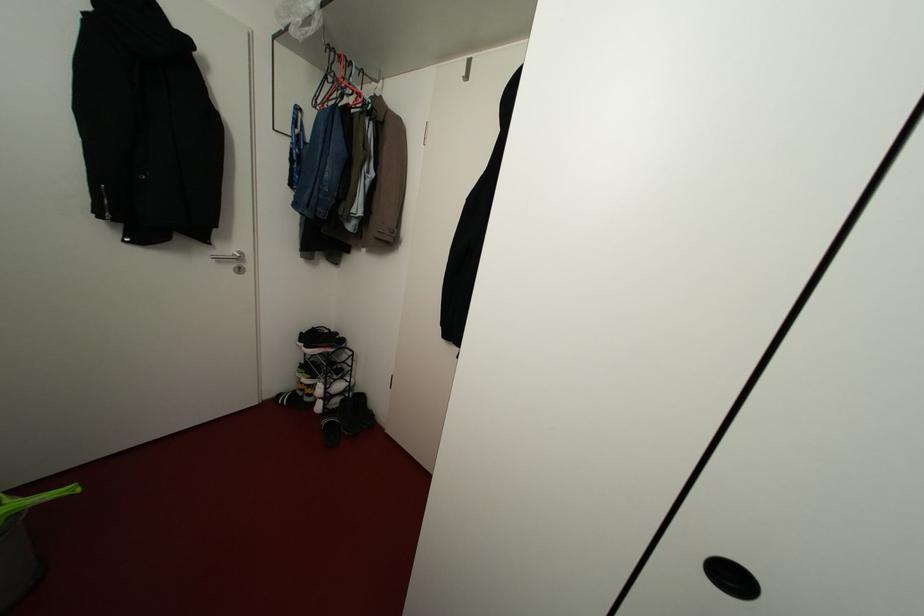
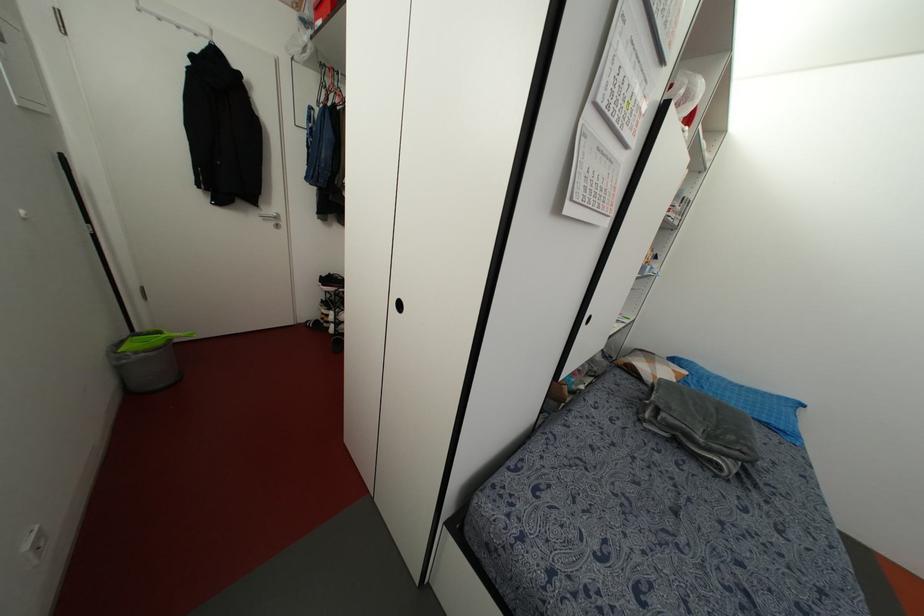
Where in the second image is the point corresponding to (330,47) from the first image?

(322, 63)